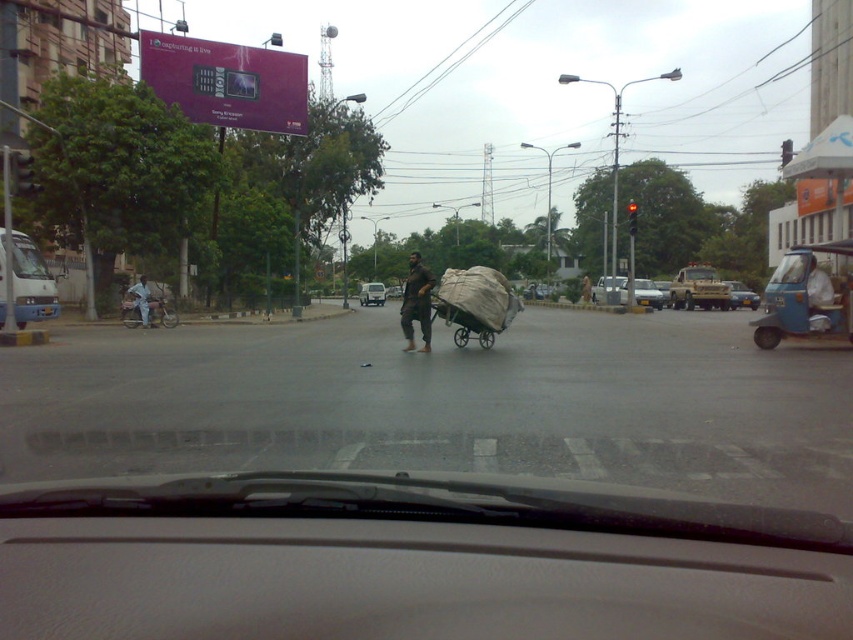
Question: Which object appears farthest from the camera in this image?

Choices:
 (A) silver metallic sedan at center
 (B) light blue fabric at left
 (C) metallic silver truck at center
 (D) matte blue truck at left

Answer: (C)

Question: Which of the following is the farthest from the observer?

Choices:
 (A) metallic silver car at center
 (B) camouflage fabric truck at center
 (C) silver metallic sedan at center

Answer: (A)

Question: Does silver metallic sedan at center have a lesser width compared to matte black car at center?

Choices:
 (A) no
 (B) yes

Answer: (A)

Question: Which of the following is the closest to the observer?

Choices:
 (A) (621, 294)
 (B) (706, 288)
 (C) (142, 316)
 (D) (581, 282)

Answer: (C)

Question: Observing the image, what is the correct spatial positioning of green fabric cart at center in reference to dark brown fabric at center?

Choices:
 (A) above
 (B) below

Answer: (B)

Question: Is metallic silver car at center in front of dark brown leather jacket at center?

Choices:
 (A) no
 (B) yes

Answer: (B)